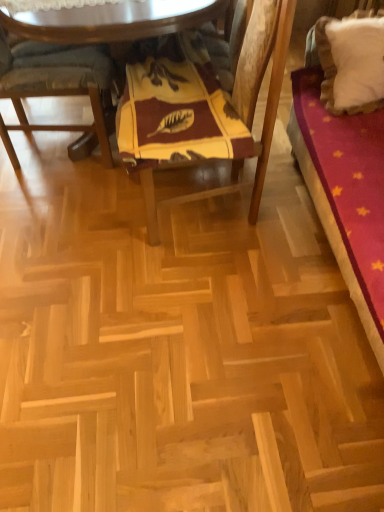
Describe the element at coordinates (204, 106) in the screenshot. I see `yellow fabric cushion at center, acting as the 1th chair starting from the right` at that location.

This screenshot has width=384, height=512. I want to click on wooden table at center, so click(x=113, y=20).

Describe the element at coordinates (326, 64) in the screenshot. The width and height of the screenshot is (384, 512). I see `white fluffy pillow at upper right` at that location.

What do you see at coordinates (178, 114) in the screenshot? The height and width of the screenshot is (512, 384). I see `yellowvelvet-like fabricblanket at center` at bounding box center [178, 114].

Locate an element on the screen. This screenshot has width=384, height=512. natural wood parquet floor at center is located at coordinates (178, 353).

I want to click on blanket below the wooden cushioned chair at left, the 2th chair viewed from the right (from the image's perspective), so click(x=178, y=114).

Relative to wooden cushioned chair at left, the 2th chair viewed from the right, is yellowvelvet-like fabricblanket at center in front or behind?

yellowvelvet-like fabricblanket at center is in front of wooden cushioned chair at left, the 2th chair viewed from the right.

Is yellowvelvet-like fabricblanket at center facing away from wooden cushioned chair at left, the 1th chair positioned from the left?

No, yellowvelvet-like fabricblanket at center is not facing away from wooden cushioned chair at left, the 1th chair positioned from the left.

Is yellowvelvet-like fabricblanket at center positioned beyond the bounds of wooden cushioned chair at left, the 2th chair viewed from the right?

Yes, yellowvelvet-like fabricblanket at center is not within wooden cushioned chair at left, the 2th chair viewed from the right.

From a real-world perspective, is yellowvelvet-like fabricblanket at center physically located above or below natural wood parquet floor at center?

In terms of real-world spatial position, yellowvelvet-like fabricblanket at center is above natural wood parquet floor at center.

Is point (150, 110) more distant than point (297, 376)?

Yes, it is behind point (297, 376).

Could you tell me if yellowvelvet-like fabricblanket at center is facing natural wood parquet floor at center?

No.

In the scene shown: Is yellowvelvet-like fabricblanket at center located outside natural wood parquet floor at center?

That's correct, yellowvelvet-like fabricblanket at center is outside of natural wood parquet floor at center.

From the image's perspective, which is below, natural wood parquet floor at center or yellow fabric cushion at center, acting as the second chair starting from the left?

From the image's view, yellow fabric cushion at center, acting as the second chair starting from the left, is below.

Considering the sizes of natural wood parquet floor at center and yellow fabric cushion at center, acting as the 1th chair starting from the right, in the image, is natural wood parquet floor at center taller or shorter than yellow fabric cushion at center, acting as the 1th chair starting from the right,?

natural wood parquet floor at center is shorter than yellow fabric cushion at center, acting as the 1th chair starting from the right.

Is natural wood parquet floor at center not near yellow fabric cushion at center, acting as the second chair starting from the left?

No, there isn't a large distance between natural wood parquet floor at center and yellow fabric cushion at center, acting as the second chair starting from the left.

Where is `plywood that appears behind the yellow fabric cushion at center, acting as the second chair starting from the left`? The image size is (384, 512). plywood that appears behind the yellow fabric cushion at center, acting as the second chair starting from the left is located at coordinates (178, 353).

Considering the relative positions of natural wood parquet floor at center and velvet red bed at right in the image provided, is natural wood parquet floor at center to the right of velvet red bed at right from the viewer's perspective?

No.

Identify the location of plywood above the velvet red bed at right (from the image's perspective). The image size is (384, 512). pyautogui.click(x=178, y=353).

Is there a large distance between natural wood parquet floor at center and velvet red bed at right?

No, natural wood parquet floor at center is in close proximity to velvet red bed at right.

Which is less distant, (x=61, y=416) or (x=376, y=157)?

Point (x=61, y=416) appears to be closer to the viewer than point (x=376, y=157).

From a real-world perspective, is yellow fabric cushion at center, acting as the second chair starting from the left, above or below velvet red bed at right?

In terms of real-world spatial position, yellow fabric cushion at center, acting as the second chair starting from the left, is above velvet red bed at right.

Based on their positions, is yellow fabric cushion at center, acting as the second chair starting from the left, located to the left or right of velvet red bed at right?

In the image, yellow fabric cushion at center, acting as the second chair starting from the left, appears on the left side of velvet red bed at right.

Considering the relative sizes of yellow fabric cushion at center, acting as the 1th chair starting from the right, and velvet red bed at right in the image provided, is yellow fabric cushion at center, acting as the 1th chair starting from the right, thinner than velvet red bed at right?

Yes, yellow fabric cushion at center, acting as the 1th chair starting from the right, is thinner than velvet red bed at right.

Who is shorter, yellow fabric cushion at center, acting as the 1th chair starting from the right, or velvet red bed at right?

With less height is velvet red bed at right.

Which of these two, velvet red bed at right or yellow fabric cushion at center, acting as the 1th chair starting from the right, stands shorter?

Standing shorter between the two is velvet red bed at right.

You are a GUI agent. You are given a task and a screenshot of the screen. Output one action in this format:
    pyautogui.click(x=<x>, y=<y>)
    Task: Click on the bed in front of the yellow fabric cushion at center, acting as the second chair starting from the left
    
    Given the screenshot: What is the action you would take?
    pyautogui.click(x=343, y=178)

Which is in front, velvet red bed at right or yellow fabric cushion at center, acting as the 1th chair starting from the right?

velvet red bed at right is in front.

Can you confirm if velvet red bed at right is bigger than yellow fabric cushion at center, acting as the second chair starting from the left?

Indeed, velvet red bed at right has a larger size compared to yellow fabric cushion at center, acting as the second chair starting from the left.

From a real-world perspective, is yellow fabric cushion at center, acting as the 1th chair starting from the right, above or below wooden cushioned chair at left, the 1th chair positioned from the left?

yellow fabric cushion at center, acting as the 1th chair starting from the right, is situated higher than wooden cushioned chair at left, the 1th chair positioned from the left, in the real world.

The image size is (384, 512). Find the location of `chair directly beneath the yellow fabric cushion at center, acting as the second chair starting from the left (from a real-world perspective)`. chair directly beneath the yellow fabric cushion at center, acting as the second chair starting from the left (from a real-world perspective) is located at coordinates (56, 84).

Is yellow fabric cushion at center, acting as the 1th chair starting from the right, taller than wooden cushioned chair at left, the 2th chair viewed from the right?

Indeed, yellow fabric cushion at center, acting as the 1th chair starting from the right, has a greater height compared to wooden cushioned chair at left, the 2th chair viewed from the right.

Image resolution: width=384 pixels, height=512 pixels. In order to click on blanket that is on the right side of wooden cushioned chair at left, the 2th chair viewed from the right in this screenshot , I will do (x=178, y=114).

This screenshot has height=512, width=384. I want to click on plywood below the yellowvelvet-like fabricblanket at center (from a real-world perspective), so click(x=178, y=353).

Looking at the image, which one is located further to wooden table at center, yellowvelvet-like fabricblanket at center or white fluffy pillow at upper right?

white fluffy pillow at upper right lies further to wooden table at center than the other object.

Estimate the real-world distances between objects in this image. Which object is closer to yellowvelvet-like fabricblanket at center, velvet red bed at right or wooden table at center?

wooden table at center is positioned closer to the anchor yellowvelvet-like fabricblanket at center.

Estimate the real-world distances between objects in this image. Which object is closer to yellow fabric cushion at center, acting as the 1th chair starting from the right, wooden table at center or velvet red bed at right?

wooden table at center is closer to yellow fabric cushion at center, acting as the 1th chair starting from the right.

Which object lies further to the anchor point natural wood parquet floor at center, wooden cushioned chair at left, the 1th chair positioned from the left, or velvet red bed at right?

wooden cushioned chair at left, the 1th chair positioned from the left, is positioned further to the anchor natural wood parquet floor at center.

When comparing their distances from wooden cushioned chair at left, the 2th chair viewed from the right, does natural wood parquet floor at center or yellow fabric cushion at center, acting as the second chair starting from the left, seem closer?

Among the two, yellow fabric cushion at center, acting as the second chair starting from the left, is located nearer to wooden cushioned chair at left, the 2th chair viewed from the right.

Estimate the real-world distances between objects in this image. Which object is closer to wooden table at center, velvet red bed at right or wooden cushioned chair at left, the 2th chair viewed from the right?

The object closer to wooden table at center is wooden cushioned chair at left, the 2th chair viewed from the right.

Estimate the real-world distances between objects in this image. Which object is further from wooden table at center, white fluffy pillow at upper right or natural wood parquet floor at center?

natural wood parquet floor at center is positioned further to the anchor wooden table at center.

In the scene shown: Looking at the image, which one is located further to velvet red bed at right, yellow fabric cushion at center, acting as the second chair starting from the left, or wooden table at center?

Based on the image, wooden table at center appears to be further to velvet red bed at right.

The image size is (384, 512). Identify the location of chair between yellowvelvet-like fabricblanket at center and white fluffy pillow at upper right in the horizontal direction. (204, 106).

This screenshot has height=512, width=384. I want to click on chair between wooden table at center and velvet red bed at right, so click(x=204, y=106).

Where is `blanket located between wooden cushioned chair at left, the 2th chair viewed from the right, and natural wood parquet floor at center in the left-right direction`? The height and width of the screenshot is (512, 384). blanket located between wooden cushioned chair at left, the 2th chair viewed from the right, and natural wood parquet floor at center in the left-right direction is located at coordinates (178, 114).

I want to click on blanket that lies between wooden table at center and natural wood parquet floor at center from top to bottom, so click(178, 114).